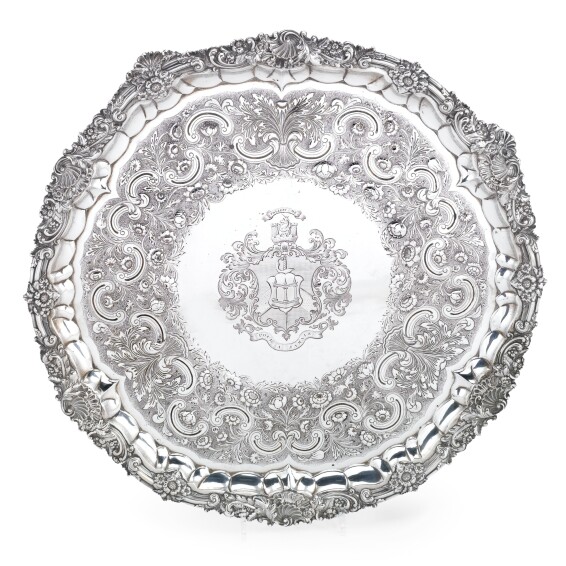
The height and width of the screenshot is (566, 566). I want to click on intricate design on border of tray, so click(32, 294).